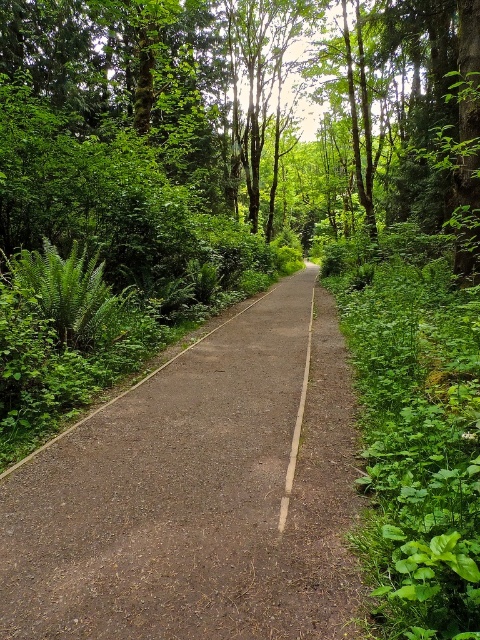
How distant is dull brown asphalt at center from white painted line at center?

dull brown asphalt at center is 3.32 meters away from white painted line at center.

Does dull brown asphalt at center come behind white painted line at center?

No, dull brown asphalt at center is in front of white painted line at center.

Which is behind, point (191, 550) or point (300, 428)?

The point (300, 428) is behind.

Identify the location of dull brown asphalt at center. pos(199,493).